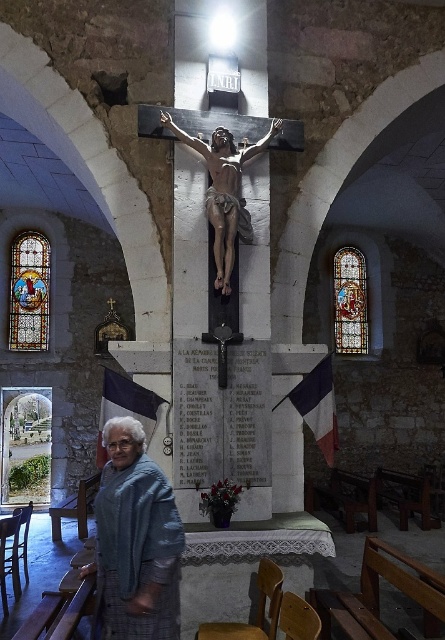
Is the position of blue plaid shawl at lower left less distant than that of matte stone crucifix at center?

Yes, blue plaid shawl at lower left is closer to the viewer.

Can you confirm if blue plaid shawl at lower left is thinner than matte stone crucifix at center?

Correct, blue plaid shawl at lower left's width is less than matte stone crucifix at center's.

Is point (172, 518) farther from camera compared to point (222, 141)?

No.

This screenshot has width=445, height=640. I want to click on blue plaid shawl at lower left, so click(134, 541).

Does stained glass window at left appear over stained glass window at upper center?

Yes.

Which is below, stained glass window at left or stained glass window at upper center?

Positioned lower is stained glass window at upper center.

I want to click on stained glass window at left, so click(x=29, y=292).

Between matte stone crucifix at center and stained glass window at left, which one has more height?

With more height is stained glass window at left.

Who is positioned more to the right, matte stone crucifix at center or stained glass window at left?

matte stone crucifix at center is more to the right.

The image size is (445, 640). What do you see at coordinates (225, 189) in the screenshot? I see `matte stone crucifix at center` at bounding box center [225, 189].

Where is `matte stone crucifix at center`? matte stone crucifix at center is located at coordinates (225, 189).